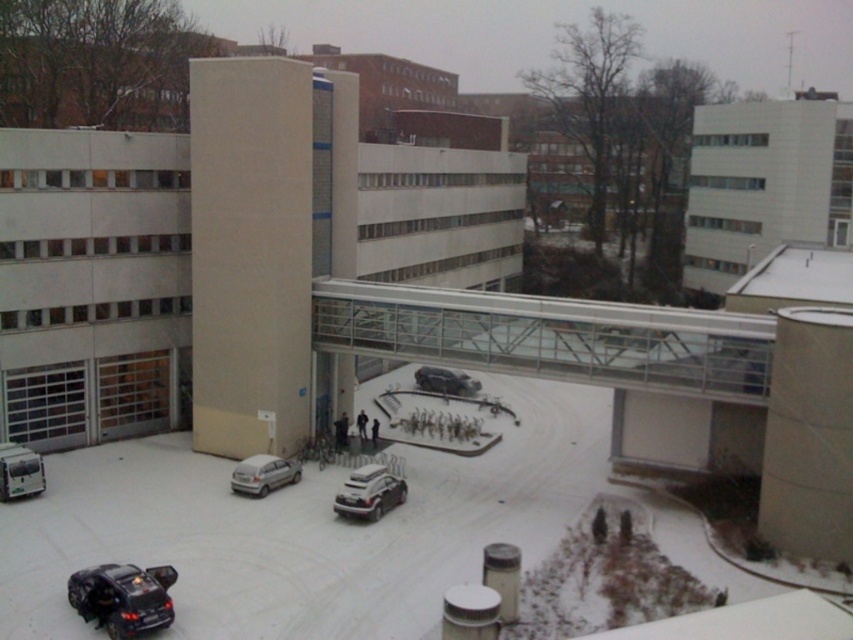
You are standing in the courtyard and want to park your car in the white concrete parking garage at upper right. Which direction should you move relative to the satin silver car at lower left?

You should move towards the upper right direction relative to the satin silver car at lower left because the white concrete parking garage at upper right is further to the viewer than the satin silver car at lower left, meaning it is closer to your current position.

You are a delivery driver who needs to park your satin silver car at lower left in a spot near the white concrete parking garage at upper right. Given that the parking garage is larger, will you have enough space to maneuver your car into a spot adjacent to it?

The white concrete parking garage at upper right is larger in size than the satin silver car at lower left, so there should be sufficient space to maneuver the satin silver car at lower left into a spot adjacent to it.